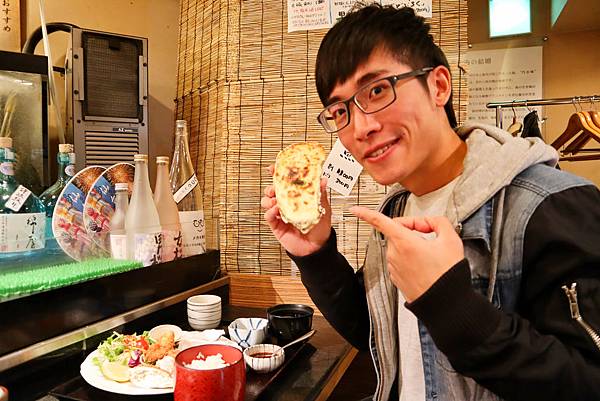
Where is `wooden hangers`? wooden hangers is located at coordinates (513, 127), (530, 123), (575, 127), (587, 124), (596, 117).